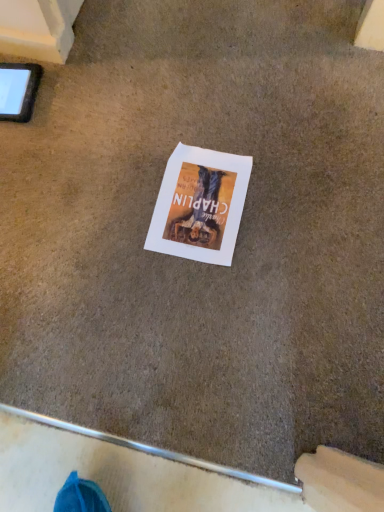
The width and height of the screenshot is (384, 512). I want to click on empty space that is ontop of white paper at center (from a real-world perspective), so click(x=197, y=201).